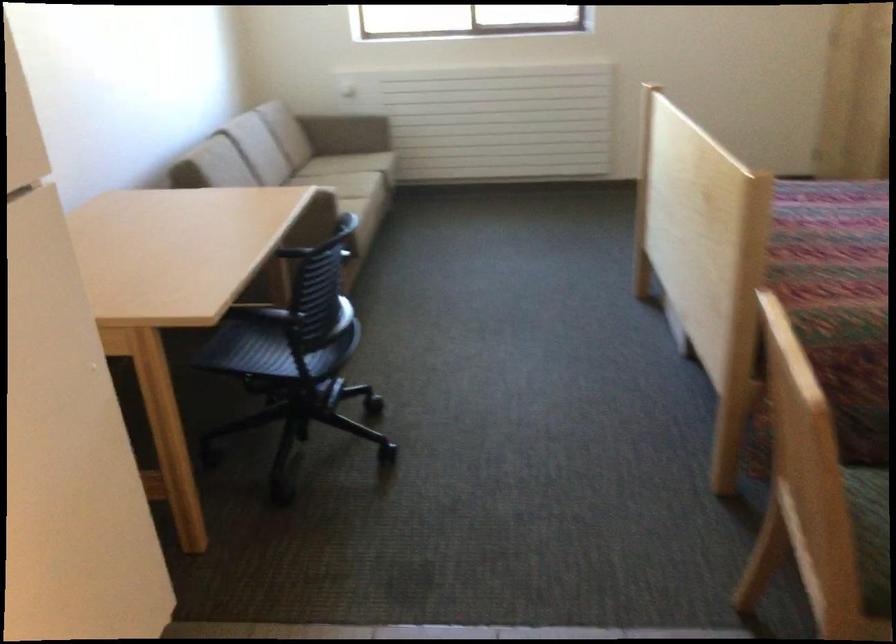
Find where to push the sofa armrest. Please return your answer as a coordinate pair (x, y).

(355, 122)